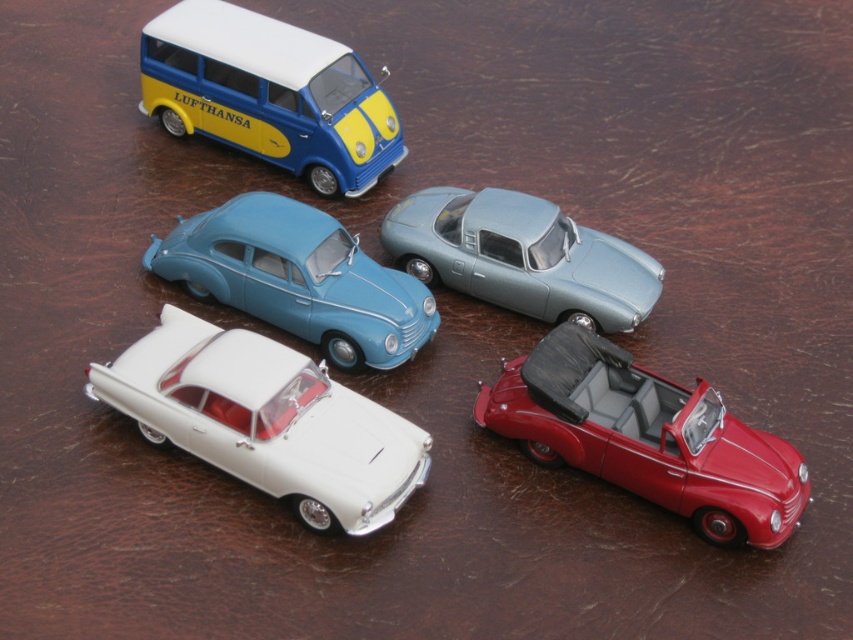
Question: Is matte blue car at center-left to the right of satin silver car at upper center from the viewer's perspective?

Choices:
 (A) yes
 (B) no

Answer: (B)

Question: Does white glossy sedan at center appear over matte blue car at center-left?

Choices:
 (A) yes
 (B) no

Answer: (B)

Question: Which point is farther from the camera taking this photo?

Choices:
 (A) (341, 168)
 (B) (276, 468)
 (C) (758, 544)

Answer: (A)

Question: Which object appears closest to the camera in this image?

Choices:
 (A) satin silver car at upper center
 (B) shiny red convertible at bottom right
 (C) white glossy sedan at center

Answer: (C)

Question: Can you confirm if white glossy sedan at center is positioned to the left of blue matte van at upper left?

Choices:
 (A) yes
 (B) no

Answer: (B)

Question: Which of these objects is positioned closest to the shiny red convertible at bottom right?

Choices:
 (A) white glossy sedan at center
 (B) satin silver car at upper center
 (C) matte blue car at center-left

Answer: (B)